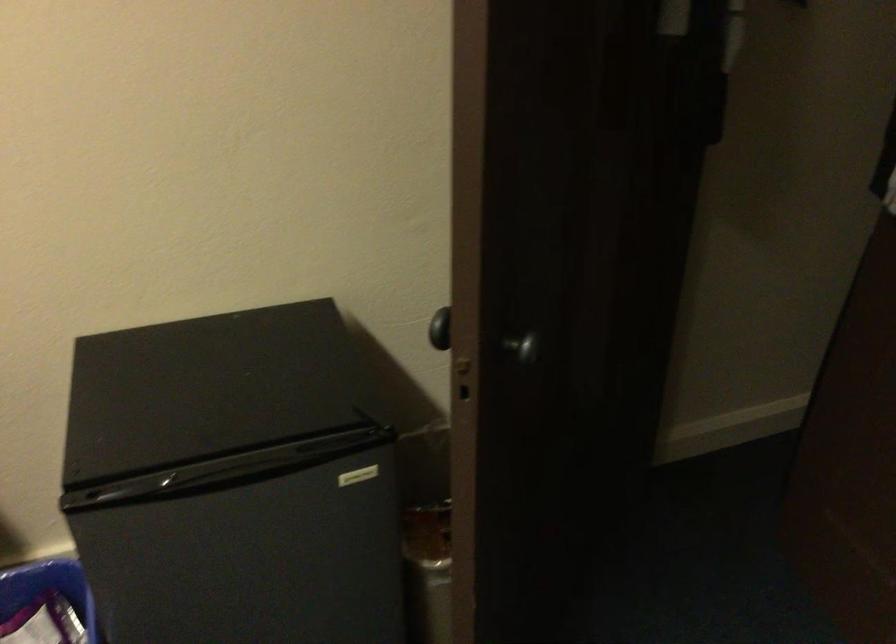
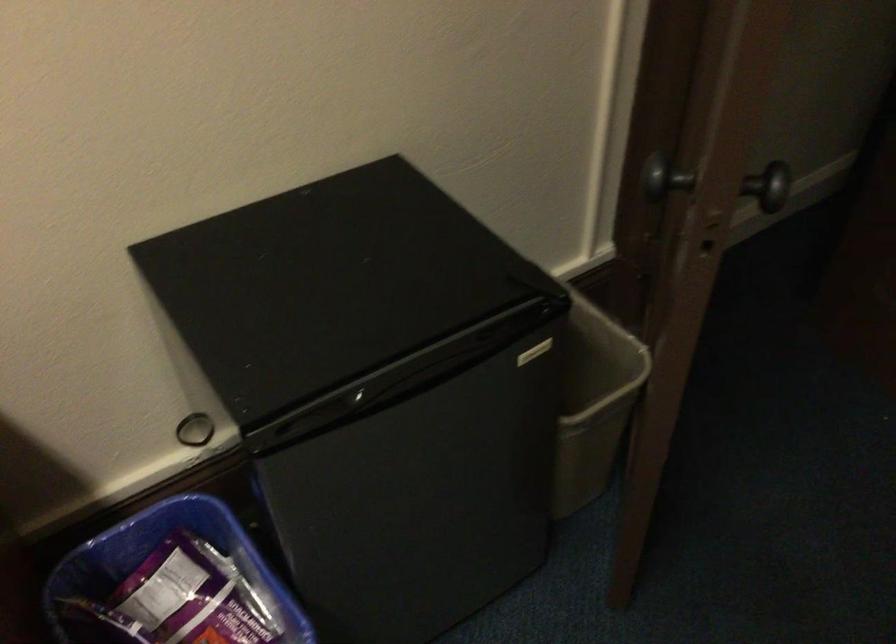
Locate, in the second image, the point that corresponds to the point at 177,480 in the first image.

(365, 399)